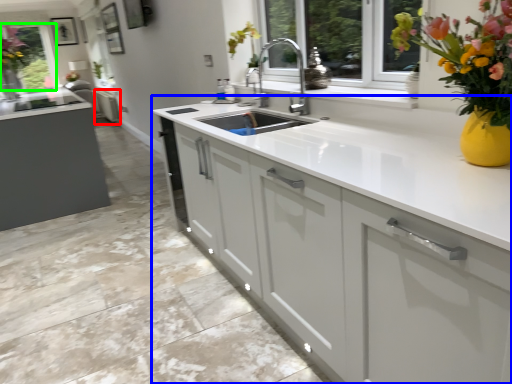
Question: Which object is the closest to the cabinetry (highlighted by a red box)? Choose among these: cabinetry (highlighted by a blue box) or window screen (highlighted by a green box).

Choices:
 (A) cabinetry
 (B) window screen

Answer: (B)